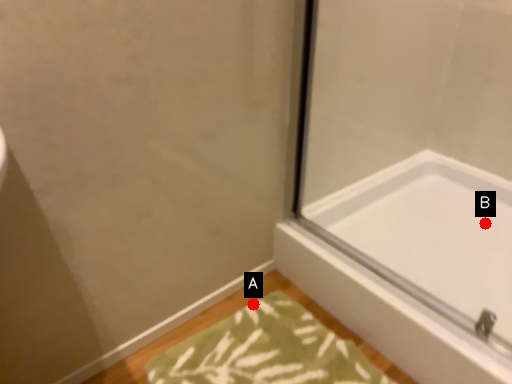
Question: Two points are circled on the image, labeled by A and B beside each circle. Among these points, which one is nearest to the camera?

Choices:
 (A) A is closer
 (B) B is closer

Answer: (A)